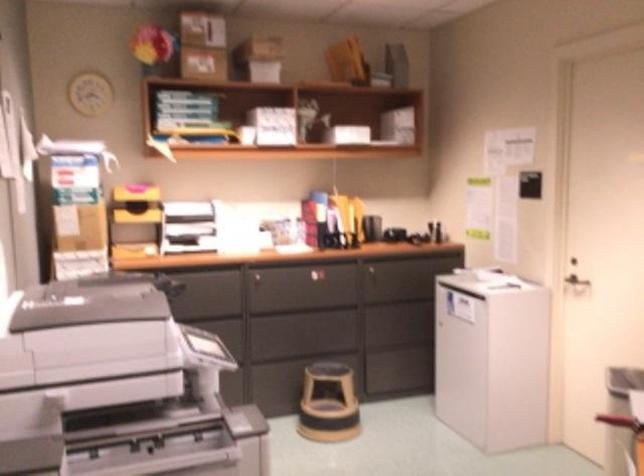
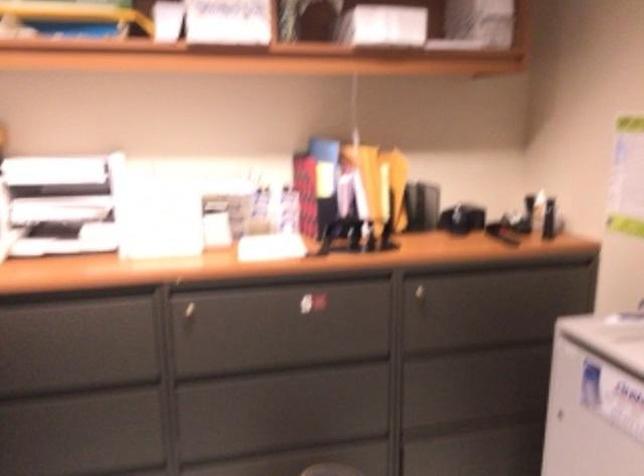
In the second image, find the point that corresponds to (x=301, y=295) in the first image.

(279, 338)